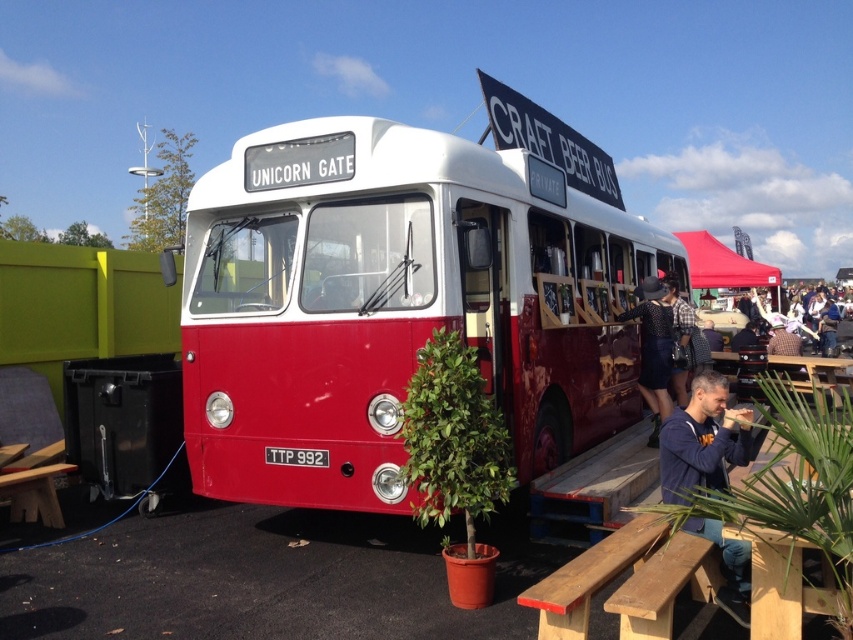
Question: Estimate the real-world distances between objects in this image. Which object is closer to the wooden picnic table at lower right?

Choices:
 (A) blue cotton shirt at lower right
 (B) matte red bus at center
 (C) red fabric canopy at upper right
 (D) polka dot dress at center

Answer: (C)

Question: Which point is farther to the camera?

Choices:
 (A) (663, 337)
 (B) (689, 449)
 (C) (689, 340)
 (D) (683, 243)

Answer: (D)

Question: Does black dotted dress at center have a greater width compared to wooden picnic table at lower right?

Choices:
 (A) yes
 (B) no

Answer: (B)

Question: Does blue cotton shirt at lower right come in front of polka dot dress at center?

Choices:
 (A) yes
 (B) no

Answer: (A)

Question: Among these points, which one is nearest to the camera?

Choices:
 (A) (724, 392)
 (B) (704, 237)
 (C) (668, 250)

Answer: (A)

Question: Is blue cotton shirt at lower right below red fabric canopy at upper right?

Choices:
 (A) yes
 (B) no

Answer: (A)